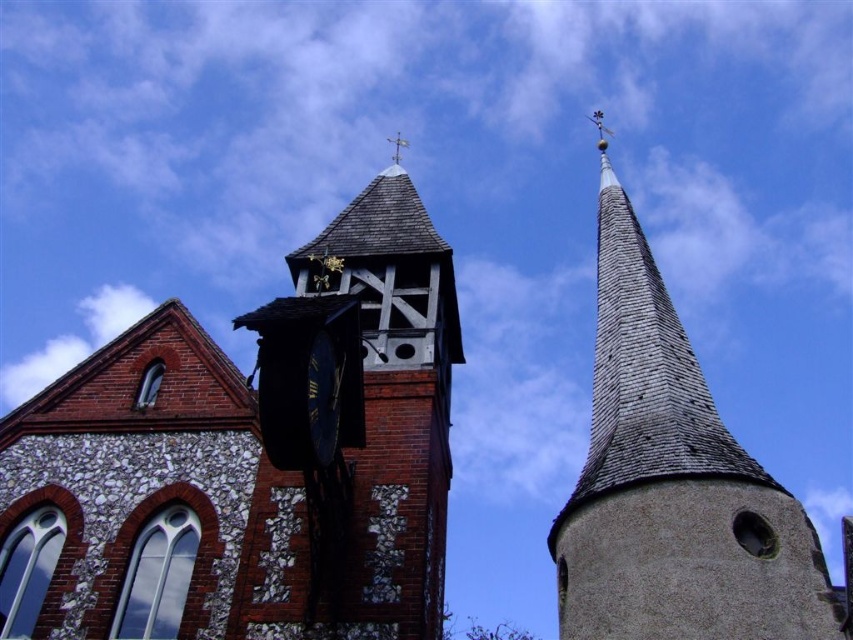
Question: Is gray stone steeple at upper right below blue metallic clock at center?

Choices:
 (A) yes
 (B) no

Answer: (B)

Question: Can you confirm if gray stone steeple at upper right is positioned below blue metallic clock at center?

Choices:
 (A) yes
 (B) no

Answer: (B)

Question: Estimate the real-world distances between objects in this image. Which object is closer to the blue metallic clock at center?

Choices:
 (A) gray stone steeple at upper right
 (B) brick clock tower at center

Answer: (B)

Question: Which of the following is the farthest from the observer?

Choices:
 (A) (759, 513)
 (B) (436, 344)
 (C) (323, 378)

Answer: (B)

Question: Can you confirm if gray stone steeple at upper right is thinner than blue metallic clock at center?

Choices:
 (A) no
 (B) yes

Answer: (A)

Question: Considering the real-world distances, which object is closest to the brick clock tower at center?

Choices:
 (A) gray stone steeple at upper right
 (B) blue metallic clock at center

Answer: (A)